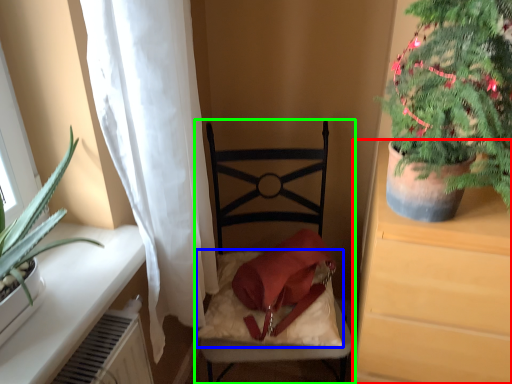
Question: Which object is positioned closest to cabinetry (highlighted by a red box)? Select from pillow (highlighted by a blue box) and chair (highlighted by a green box).

Choices:
 (A) pillow
 (B) chair

Answer: (A)